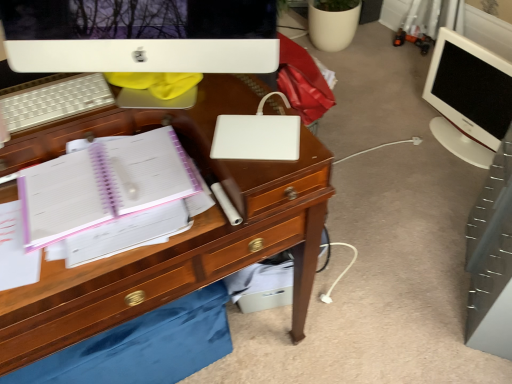
Question: From a real-world perspective, is white plastic keyboard at upper left physically above white glossy monitor at right, the first computer monitor viewed from the right?

Choices:
 (A) yes
 (B) no

Answer: (A)

Question: Is white plastic keyboard at upper left next to white glossy monitor at right, positioned as the first computer monitor in back-to-front order, and touching it?

Choices:
 (A) no
 (B) yes

Answer: (A)

Question: Is white plastic keyboard at upper left located outside white glossy monitor at right, the second computer monitor positioned from the front?

Choices:
 (A) yes
 (B) no

Answer: (A)

Question: Considering the relative sizes of white plastic keyboard at upper left and white glossy monitor at right, positioned as the first computer monitor in back-to-front order, in the image provided, is white plastic keyboard at upper left shorter than white glossy monitor at right, positioned as the first computer monitor in back-to-front order,?

Choices:
 (A) no
 (B) yes

Answer: (B)

Question: Is white plastic keyboard at upper left thinner than white glossy monitor at right, the 2th computer monitor in the left-to-right sequence?

Choices:
 (A) yes
 (B) no

Answer: (A)

Question: Looking at the image, does white matte laptop at center seem bigger or smaller compared to white glossy monitor at right, the second computer monitor positioned from the front?

Choices:
 (A) small
 (B) big

Answer: (A)

Question: Relative to white glossy monitor at right, the 2th computer monitor in the left-to-right sequence, is white matte laptop at center in front or behind?

Choices:
 (A) behind
 (B) front

Answer: (B)

Question: Considering the positions of white matte laptop at center and white glossy monitor at right, the second computer monitor positioned from the front, in the image, is white matte laptop at center wider or thinner than white glossy monitor at right, the second computer monitor positioned from the front,?

Choices:
 (A) wide
 (B) thin

Answer: (B)

Question: Does point (245, 122) appear closer or farther from the camera than point (432, 100)?

Choices:
 (A) closer
 (B) farther

Answer: (A)

Question: In the image, is white matte laptop at center on the left side or the right side of wooden drawer at lower center?

Choices:
 (A) left
 (B) right

Answer: (B)

Question: Is white matte laptop at center spatially inside wooden drawer at lower center, or outside of it?

Choices:
 (A) outside
 (B) inside

Answer: (A)

Question: Considering their positions, is white matte laptop at center located in front of or behind wooden drawer at lower center?

Choices:
 (A) front
 (B) behind

Answer: (A)

Question: From the image's perspective, is white matte laptop at center above or below wooden drawer at lower center?

Choices:
 (A) below
 (B) above

Answer: (B)

Question: Looking at their shapes, would you say white matte laptop at center is wider or thinner than white glossy computer monitor at upper center, which ranks as the 1th computer monitor in left-to-right order?

Choices:
 (A) wide
 (B) thin

Answer: (B)

Question: Considering the positions of white matte laptop at center and white glossy computer monitor at upper center, marked as the 1th computer monitor in a front-to-back arrangement, in the image, is white matte laptop at center taller or shorter than white glossy computer monitor at upper center, marked as the 1th computer monitor in a front-to-back arrangement,?

Choices:
 (A) short
 (B) tall

Answer: (A)